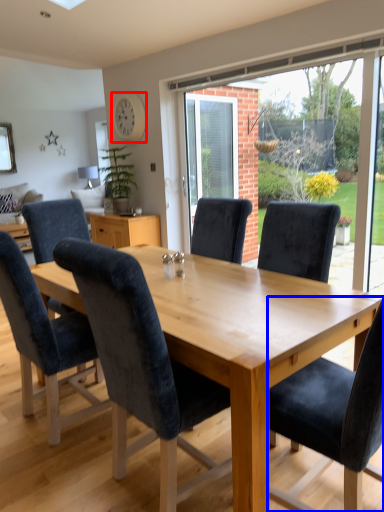
Question: Among these objects, which one is nearest to the camera, clock (highlighted by a red box) or chair (highlighted by a blue box)?

Choices:
 (A) clock
 (B) chair

Answer: (B)